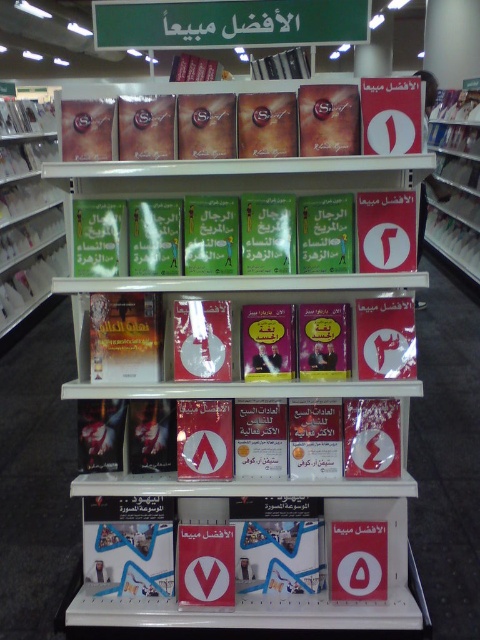
In the scene shown: You are standing in front of a bookstore shelf and see two points marked on the shelf. The first point is at coordinates point (12,316) and the second is at point (430,220). Which point is closer to you?

Point (12,316) is closer to the camera than point (430,220).

You are standing in a bookstore and see the matte plastic book at left on a shelf. If you want to reach it, would you need a ladder or can you reach it without assistance?

The matte plastic book at left is 4.91 meters away from the viewer, so you would need a ladder to reach it since it is too high to reach without assistance.